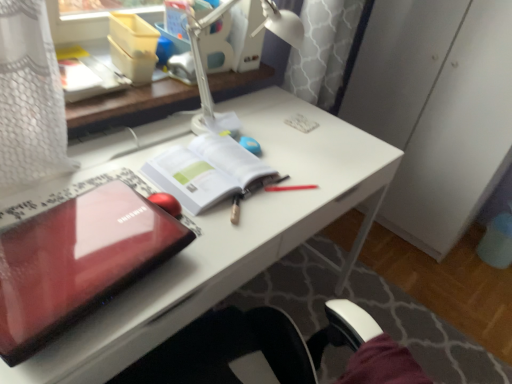
Locate an element on the screen. free location to the left of white paper at center is located at coordinates (118, 161).